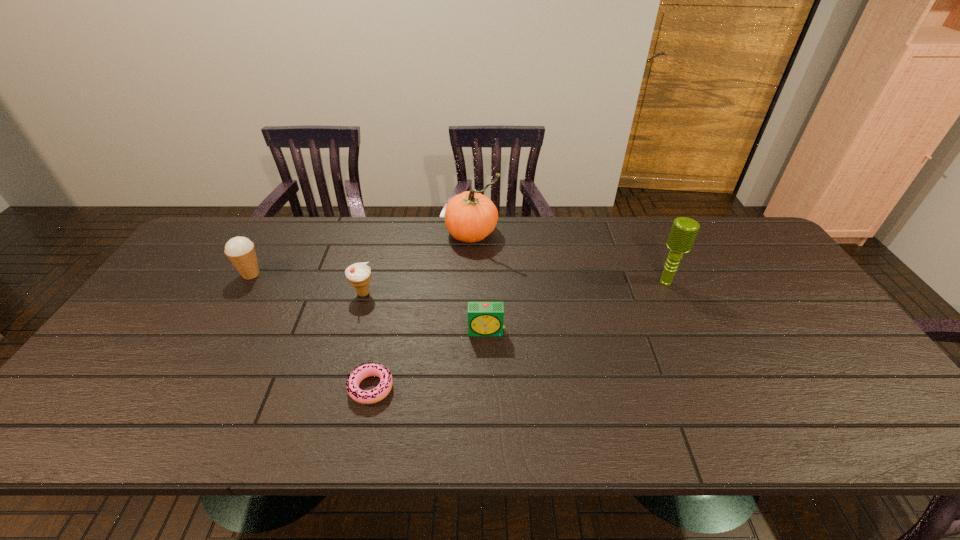
At what (x,y) coordinates should I click in order to perform the action: click on the farthest object. Please return your answer as a coordinate pair (x, y). Looking at the image, I should click on (470, 217).

You are a GUI agent. You are given a task and a screenshot of the screen. Output one action in this format:
    pyautogui.click(x=<x>, y=<y>)
    Task: Click on the pumpkin
    The height and width of the screenshot is (540, 960).
    Given the screenshot: What is the action you would take?
    pyautogui.click(x=470, y=217)

Locate an element on the screen. This screenshot has width=960, height=540. the rightmost object is located at coordinates (684, 230).

Where is `microphone`? The width and height of the screenshot is (960, 540). microphone is located at coordinates (684, 230).

You are a GUI agent. You are given a task and a screenshot of the screen. Output one action in this format:
    pyautogui.click(x=<x>, y=<y>)
    Task: Click on the left icecream
    This screenshot has height=540, width=960.
    Given the screenshot: What is the action you would take?
    pyautogui.click(x=241, y=252)

In order to click on the farther icecream in this screenshot , I will do `click(241, 252)`.

Where is `the right icecream`? the right icecream is located at coordinates (359, 274).

This screenshot has height=540, width=960. I want to click on alarm clock, so click(484, 318).

Where is `the fifth tallest object`? the fifth tallest object is located at coordinates (484, 318).

Where is `doughnut`? doughnut is located at coordinates (365, 370).